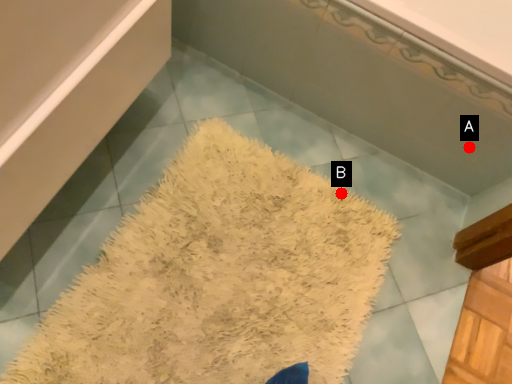
Question: Two points are circled on the image, labeled by A and B beside each circle. Which point appears closest to the camera in this image?

Choices:
 (A) A is closer
 (B) B is closer

Answer: (A)